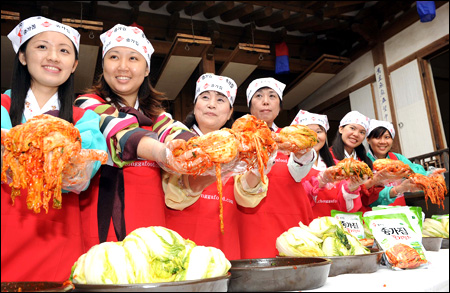
Where is `white walls`? white walls is located at coordinates (413, 110).